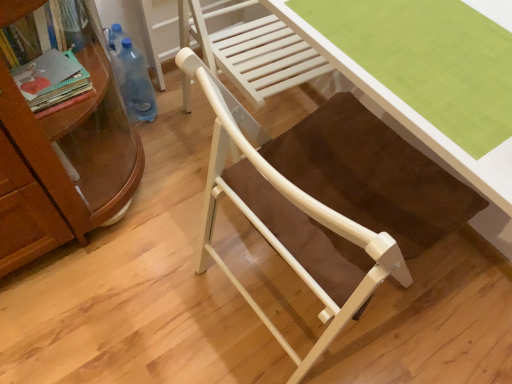
Question: Considering the relative sizes of matte white chair at center and green fabric desk at center in the image provided, is matte white chair at center smaller than green fabric desk at center?

Choices:
 (A) no
 (B) yes

Answer: (A)

Question: Are matte white chair at center and green fabric desk at center making contact?

Choices:
 (A) yes
 (B) no

Answer: (B)

Question: Is matte white chair at center turned away from green fabric desk at center?

Choices:
 (A) no
 (B) yes

Answer: (A)

Question: From the image's perspective, would you say matte white chair at center is positioned over green fabric desk at center?

Choices:
 (A) no
 (B) yes

Answer: (A)

Question: Is matte white chair at center completely or partially outside of green fabric desk at center?

Choices:
 (A) no
 (B) yes

Answer: (B)

Question: Is matte white chair at center wider or thinner than green fabric desk at center?

Choices:
 (A) thin
 (B) wide

Answer: (B)

Question: From the image's perspective, is matte white chair at center above or below green fabric desk at center?

Choices:
 (A) above
 (B) below

Answer: (B)

Question: From a real-world perspective, relative to green fabric desk at center, is matte white chair at center vertically above or below?

Choices:
 (A) above
 (B) below

Answer: (B)

Question: Is matte white chair at center situated inside green fabric desk at center or outside?

Choices:
 (A) outside
 (B) inside

Answer: (A)

Question: Is green fabric desk at center wider or thinner than blue plastic bottle at left?

Choices:
 (A) wide
 (B) thin

Answer: (A)

Question: From their relative heights in the image, would you say green fabric desk at center is taller or shorter than blue plastic bottle at left?

Choices:
 (A) short
 (B) tall

Answer: (A)

Question: From the image's perspective, is green fabric desk at center located above or below blue plastic bottle at left?

Choices:
 (A) above
 (B) below

Answer: (B)

Question: Does point (411, 109) appear closer or farther from the camera than point (140, 72)?

Choices:
 (A) farther
 (B) closer

Answer: (B)

Question: In terms of width, does blue plastic bottle at left look wider or thinner when compared to matte white chair at center?

Choices:
 (A) wide
 (B) thin

Answer: (B)

Question: Considering the relative positions of blue plastic bottle at left and matte white chair at center in the image provided, is blue plastic bottle at left to the left or to the right of matte white chair at center?

Choices:
 (A) right
 (B) left

Answer: (B)